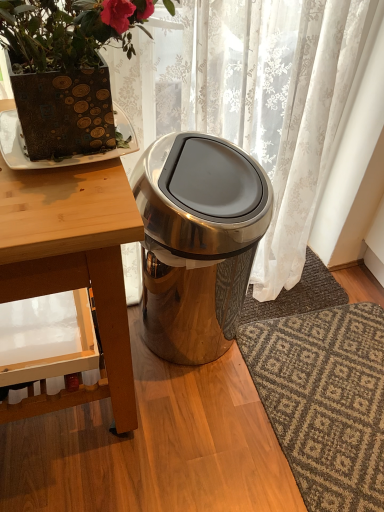
Question: From a real-world perspective, is matte brown pot at upper left over satin silver trash can at center?

Choices:
 (A) no
 (B) yes

Answer: (B)

Question: Does matte brown pot at upper left come behind satin silver trash can at center?

Choices:
 (A) no
 (B) yes

Answer: (A)

Question: Could you tell me if matte brown pot at upper left is turned towards satin silver trash can at center?

Choices:
 (A) no
 (B) yes

Answer: (A)

Question: Is matte brown pot at upper left bigger than satin silver trash can at center?

Choices:
 (A) no
 (B) yes

Answer: (A)

Question: From the image's perspective, is matte brown pot at upper left located above satin silver trash can at center?

Choices:
 (A) yes
 (B) no

Answer: (A)

Question: Can you confirm if matte brown pot at upper left is positioned to the right of satin silver trash can at center?

Choices:
 (A) no
 (B) yes

Answer: (A)

Question: From a real-world perspective, is dark gray textured rug at lower right, the first doormat when ordered from top to bottom, on brown textured plate at upper left?

Choices:
 (A) yes
 (B) no

Answer: (B)

Question: Does dark gray textured rug at lower right, the first doormat when ordered from top to bottom, have a greater width compared to brown textured plate at upper left?

Choices:
 (A) yes
 (B) no

Answer: (A)

Question: Does dark gray textured rug at lower right, the first doormat when ordered from top to bottom, contain brown textured plate at upper left?

Choices:
 (A) yes
 (B) no

Answer: (B)

Question: From the image's perspective, is dark gray textured rug at lower right, which ranks as the second doormat in bottom-to-top order, under brown textured plate at upper left?

Choices:
 (A) yes
 (B) no

Answer: (A)

Question: Considering the relative sizes of dark gray textured rug at lower right, which ranks as the second doormat in bottom-to-top order, and brown textured plate at upper left in the image provided, is dark gray textured rug at lower right, which ranks as the second doormat in bottom-to-top order, smaller than brown textured plate at upper left?

Choices:
 (A) yes
 (B) no

Answer: (B)

Question: Can you confirm if dark gray textured rug at lower right, which ranks as the second doormat in bottom-to-top order, is shorter than brown textured plate at upper left?

Choices:
 (A) yes
 (B) no

Answer: (A)

Question: From the image's perspective, is dark gray textured rug at lower right, which ranks as the second doormat in bottom-to-top order, over wooden table at left?

Choices:
 (A) yes
 (B) no

Answer: (A)